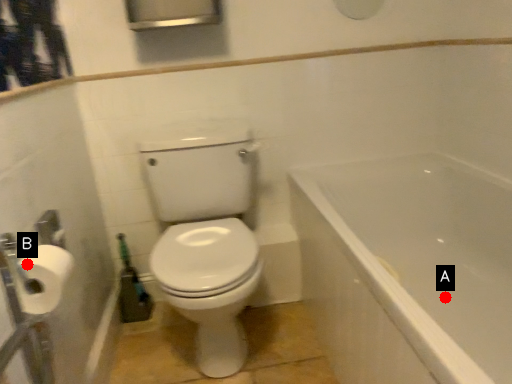
Question: Two points are circled on the image, labeled by A and B beside each circle. Which point is farther to the camera?

Choices:
 (A) A is further
 (B) B is further

Answer: (A)